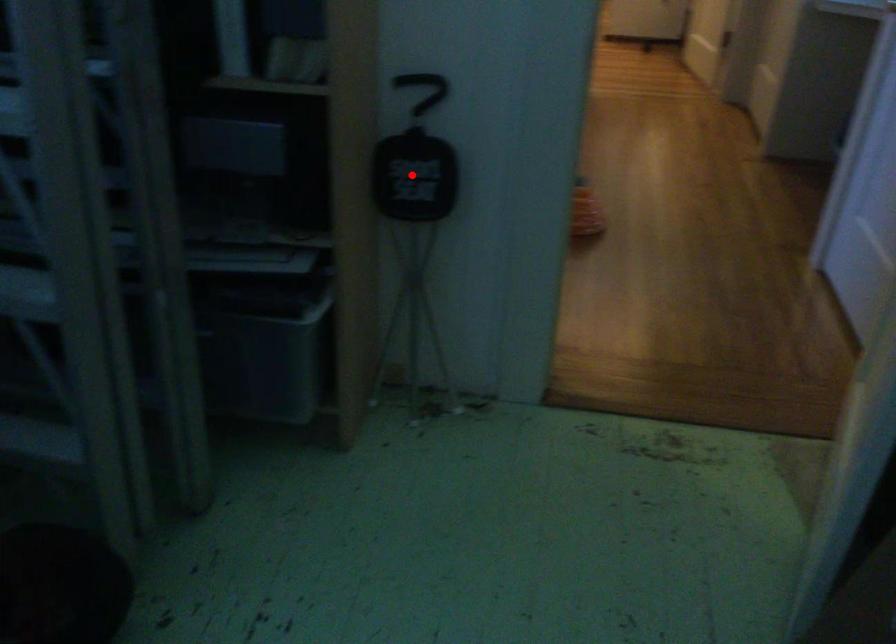
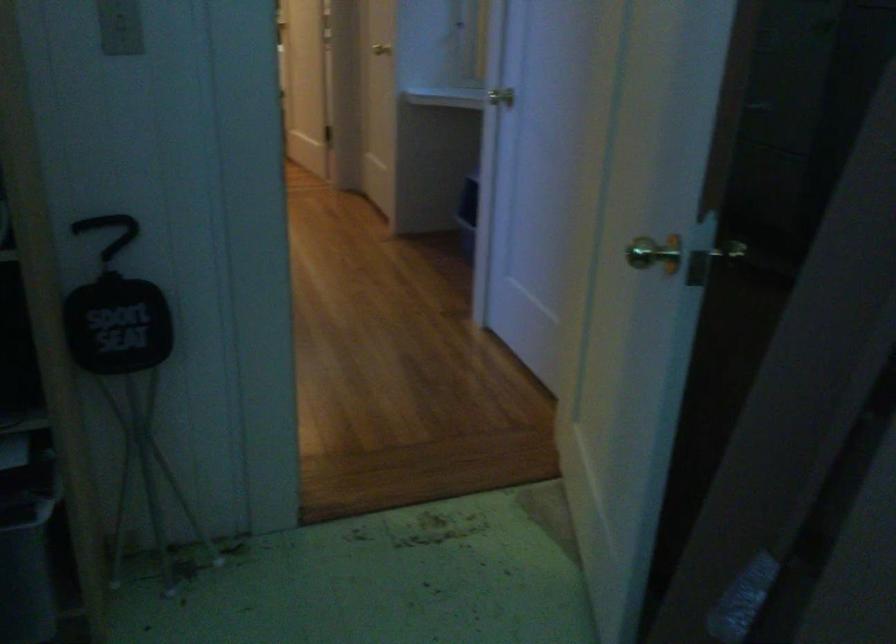
The point at the highlighted location is marked in the first image. Where is the corresponding point in the second image?

(117, 325)